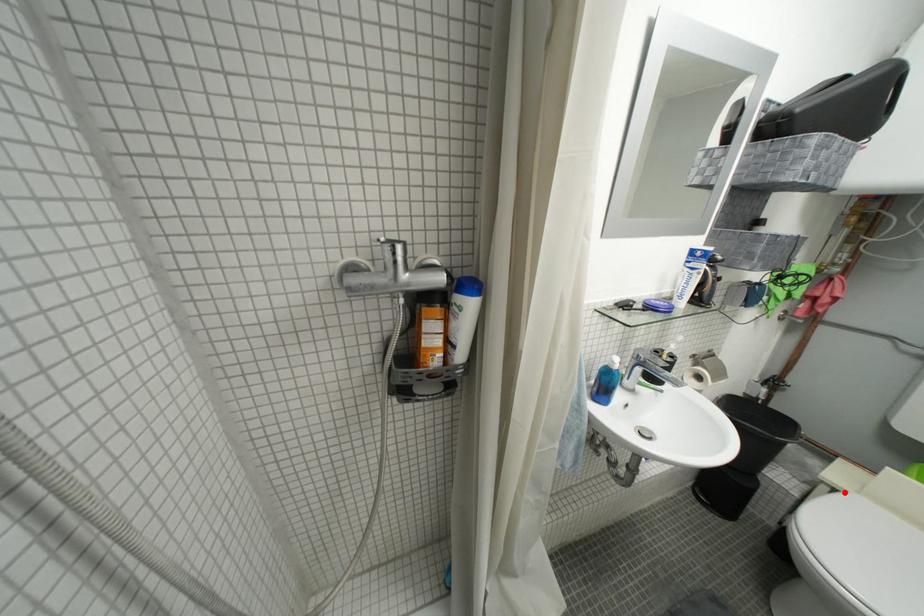
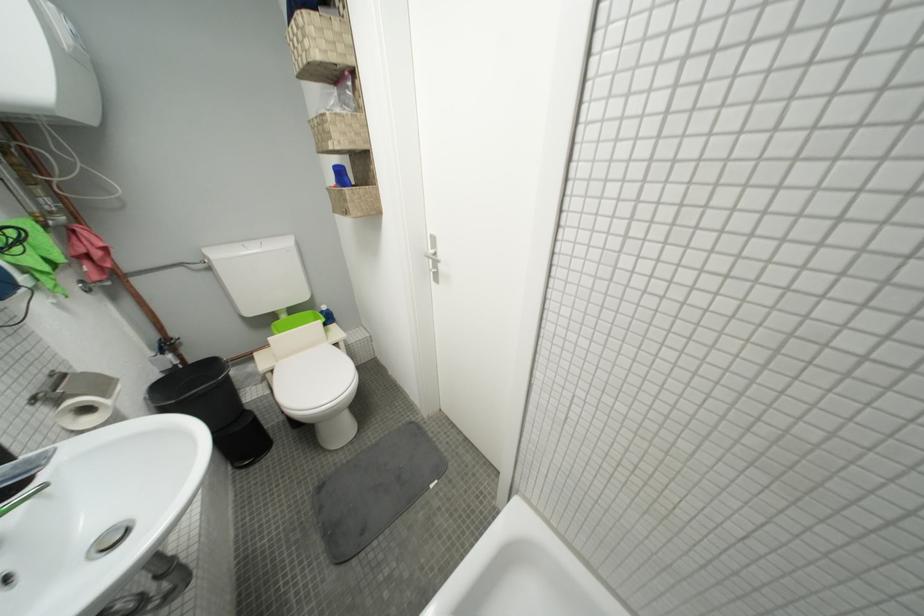
Find the pixel in the second image that matches the highlighted location in the first image.

(281, 373)